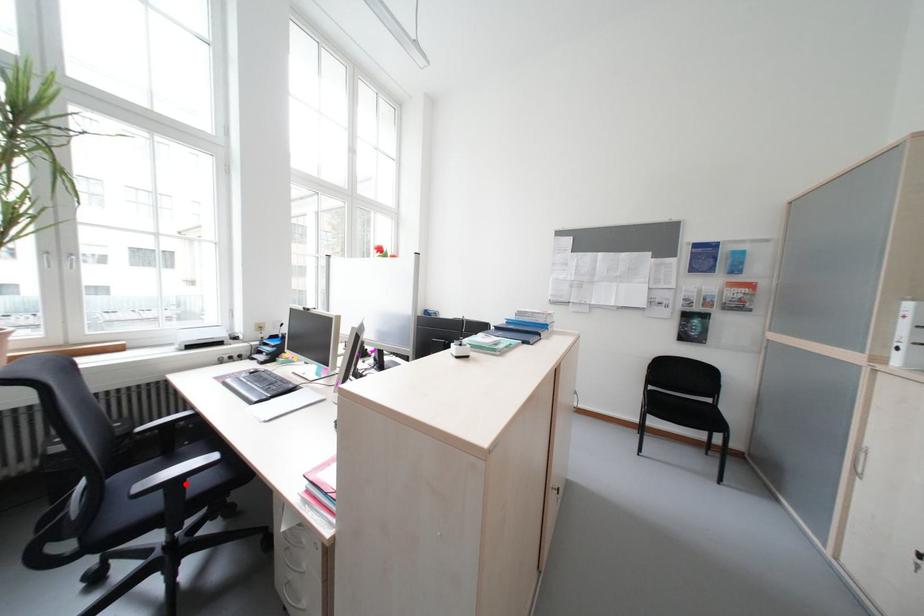
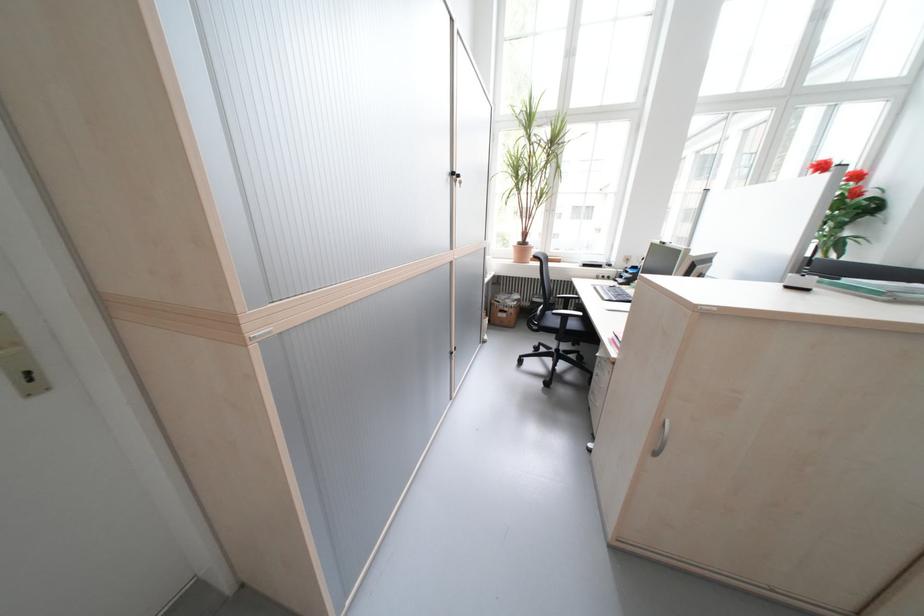
Where in the second image is the point corresponding to the highlighted location from the first image?

(575, 318)